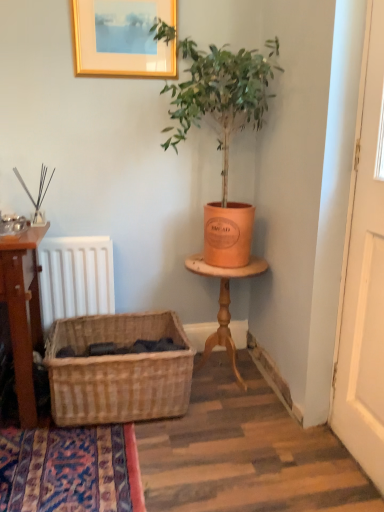
The height and width of the screenshot is (512, 384). What are the coordinates of `white wooden door at right` in the screenshot? It's located at (364, 273).

The image size is (384, 512). What are the coordinates of `orange clay pot at upper right` in the screenshot? It's located at (223, 125).

Image resolution: width=384 pixels, height=512 pixels. What do you see at coordinates (224, 305) in the screenshot?
I see `wooden table at right` at bounding box center [224, 305].

You are a GUI agent. You are given a task and a screenshot of the screen. Output one action in this format:
    pyautogui.click(x=<x>, y=<y>)
    Task: Click on the white wooden door at right
    The height and width of the screenshot is (512, 384).
    Given the screenshot: What is the action you would take?
    pyautogui.click(x=364, y=273)

Considering the sizes of objects orange clay pot at upper right and woven natural basket at lower left in the image provided, who is shorter, orange clay pot at upper right or woven natural basket at lower left?

With less height is woven natural basket at lower left.

From the picture: Which of these two, orange clay pot at upper right or woven natural basket at lower left, is smaller?

woven natural basket at lower left is smaller.

From the image's perspective, which one is positioned lower, orange clay pot at upper right or woven natural basket at lower left?

woven natural basket at lower left appears lower in the image.

Looking at this image, who is more distant, orange clay pot at upper right or woven natural basket at lower left?

woven natural basket at lower left is more distant.

Is point (332, 421) positioned before point (100, 362)?

No, (332, 421) is behind (100, 362).

Can you tell me how much white wooden door at right and woven natural basket at lower left differ in facing direction?

91.2 degrees.

Is white wooden door at right positioned beyond the bounds of woven natural basket at lower left?

Yes.

Does white wooden door at right lie in front of woven natural basket at lower left?

Yes, white wooden door at right is closer to the camera.

The height and width of the screenshot is (512, 384). In order to click on table behind the orange clay pot at upper right in this screenshot , I will do `click(224, 305)`.

Is orange clay pot at upper right smaller than wooden table at right?

Incorrect, orange clay pot at upper right is not smaller in size than wooden table at right.

Considering the positions of objects orange clay pot at upper right and wooden table at right in the image provided, who is more to the left, orange clay pot at upper right or wooden table at right?

From the viewer's perspective, orange clay pot at upper right appears more on the left side.

From the image's perspective, is orange clay pot at upper right located above or below wooden table at right?

orange clay pot at upper right is situated higher than wooden table at right in the image.

Is white wooden door at right inside or outside of wooden table at right?

white wooden door at right is not enclosed by wooden table at right.

Are white wooden door at right and wooden table at right making contact?

white wooden door at right and wooden table at right are not in contact.

In the scene shown: Does white wooden door at right have a greater width compared to wooden table at right?

No.

In the image, is white wooden door at right on the left side or the right side of wooden table at right?

Clearly, white wooden door at right is on the right of wooden table at right in the image.

This screenshot has height=512, width=384. Find the location of `basket behind the orange clay pot at upper right`. basket behind the orange clay pot at upper right is located at coordinates (118, 370).

Between woven natural basket at lower left and orange clay pot at upper right, which one has smaller width?

Thinner between the two is woven natural basket at lower left.

From the picture: Are woven natural basket at lower left and orange clay pot at upper right located far from each other?

That's not correct — woven natural basket at lower left is a little close to orange clay pot at upper right.

Is woven natural basket at lower left completely or partially outside of orange clay pot at upper right?

Absolutely, woven natural basket at lower left is external to orange clay pot at upper right.

Are gold wooden picture frame at upper center and orange clay pot at upper right far apart?

Actually, gold wooden picture frame at upper center and orange clay pot at upper right are a little close together.

In the scene shown: Can you tell me how much gold wooden picture frame at upper center and orange clay pot at upper right differ in facing direction?

They differ by 0.198 degrees in their facing directions.

Does gold wooden picture frame at upper center have a smaller size compared to orange clay pot at upper right?

Indeed, gold wooden picture frame at upper center has a smaller size compared to orange clay pot at upper right.

Would you say gold wooden picture frame at upper center is inside or outside orange clay pot at upper right?

gold wooden picture frame at upper center is not enclosed by orange clay pot at upper right.

Is wooden table at right looking in the opposite direction of white wooden door at right?

wooden table at right does not have its back to white wooden door at right.

Where is `screen door in front of the wooden table at right`? screen door in front of the wooden table at right is located at coordinates (364, 273).

Is wooden table at right to the right of white wooden door at right from the viewer's perspective?

Incorrect, wooden table at right is not on the right side of white wooden door at right.

Where is `houseplant that is on the right side of woven natural basket at lower left`? The width and height of the screenshot is (384, 512). houseplant that is on the right side of woven natural basket at lower left is located at coordinates (223, 125).

Identify the location of basket that is below the white wooden door at right (from the image's perspective). (118, 370).

Based on the photo, from the image, which object appears to be nearer to gold wooden picture frame at upper center, orange clay pot at upper right or woven natural basket at lower left?

orange clay pot at upper right lies closer to gold wooden picture frame at upper center than the other object.

From the image, which object appears to be farther from orange clay pot at upper right, woven natural basket at lower left or white wooden door at right?

Among the two, woven natural basket at lower left is located further to orange clay pot at upper right.

Looking at the image, which one is located further to woven natural basket at lower left, orange clay pot at upper right or gold wooden picture frame at upper center?

gold wooden picture frame at upper center is positioned further to the anchor woven natural basket at lower left.

Based on their spatial positions, is wooden table at right or gold wooden picture frame at upper center further from woven natural basket at lower left?

gold wooden picture frame at upper center is further to woven natural basket at lower left.

Estimate the real-world distances between objects in this image. Which object is closer to woven natural basket at lower left, wooden table at right or white wooden door at right?

wooden table at right is closer to woven natural basket at lower left.

Based on their spatial positions, is woven natural basket at lower left or gold wooden picture frame at upper center closer to orange clay pot at upper right?

The object closer to orange clay pot at upper right is gold wooden picture frame at upper center.

Based on the photo, estimate the real-world distances between objects in this image. Which object is closer to white wooden door at right, orange clay pot at upper right or gold wooden picture frame at upper center?

Based on the image, orange clay pot at upper right appears to be nearer to white wooden door at right.

Looking at the image, which one is located further to white wooden door at right, wooden table at right or gold wooden picture frame at upper center?

Based on the image, gold wooden picture frame at upper center appears to be further to white wooden door at right.

Identify the location of screen door between gold wooden picture frame at upper center and woven natural basket at lower left in the vertical direction. (364, 273).

Find the location of a particular element. houseplant that lies between gold wooden picture frame at upper center and wooden table at right from top to bottom is located at coordinates (223, 125).

This screenshot has width=384, height=512. I want to click on table between orange clay pot at upper right and woven natural basket at lower left from top to bottom, so click(x=224, y=305).

Image resolution: width=384 pixels, height=512 pixels. I want to click on houseplant between gold wooden picture frame at upper center and white wooden door at right vertically, so click(x=223, y=125).